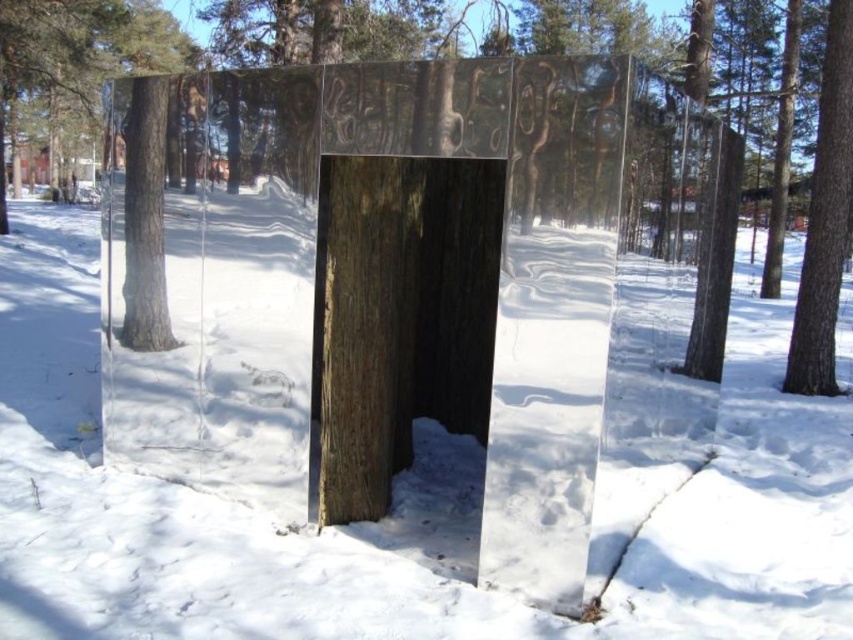
You are an artist planning to place a 15 feet long sculpture between the brown rough wood at center and the smooth brown bark at right. Based on the scene, will the sculpture fit in the space between them?

The distance between the brown rough wood at center and the smooth brown bark at right is 16.53 feet. Since the sculpture is 15 feet long, it will fit with about 1.53 feet of space remaining between them.

You are an artist planning to create a sculpture inspired by the snowy forest scene. You need to decide which material to use for the base of your sculpture. The base must be large enough to support both the white snow at center and the smooth brown bark at right. Given their sizes, which object should the base be designed to accommodate?

The base should be designed to accommodate the white snow at center since it has a larger size compared to the smooth brown bark at right, ensuring stability and proper support for both objects.

You are an architect designing a new sculpture for a winter exhibition. You observe the brown rough wood at center and the transparent wood at center in the image. Which material would you choose if you want the sculpture to appear taller in the snowy forest setting?

The transparent wood at center is taller than the brown rough wood at center, so choosing transparent wood at center would make the sculpture appear taller in the snowy forest setting.